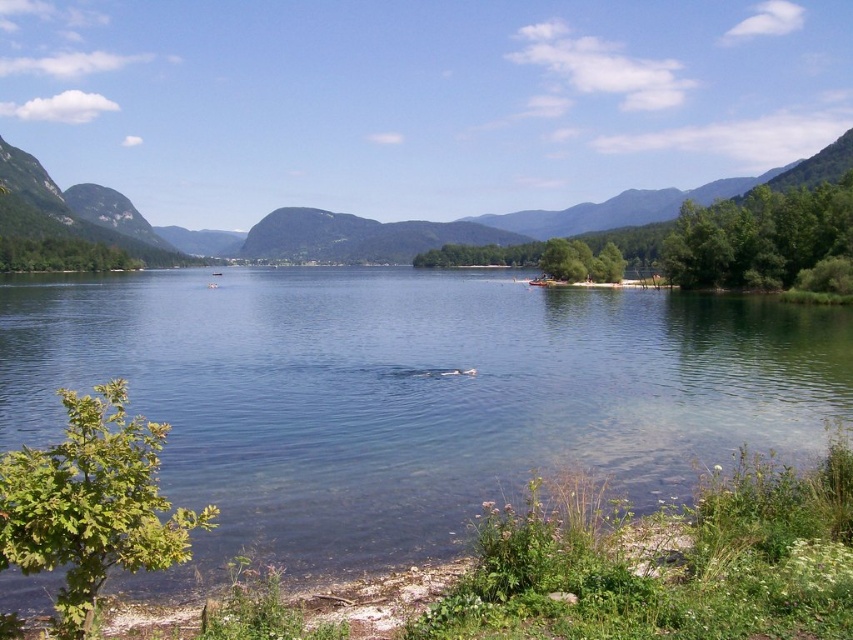
You are an observer standing at the lakeside. You see the clear blue water at center and the green forested mountain at center. Which object is located below the other?

The clear blue water at center is positioned under the green forested mountain at center.

You are an artist planning to paint this lakeside scene. You want to ensure that the clear blue water at center and the green forested mountain at center are both visible. Considering their sizes in the image, which one should you focus on painting first to ensure proper composition?

The clear blue water at center occupies less space than the green forested mountain at center, so you should focus on painting the green forested mountain at center first to ensure it is proportionally accurate before detailing the smaller area of clear blue water at center.

You are standing at the lakeside and want to take a photo of both the point at coordinates point (106, 349) and point (496, 241). Which point will appear larger in your camera view?

Point (106, 349) is closer to the camera than point (496, 241), so it will appear larger in the photo.